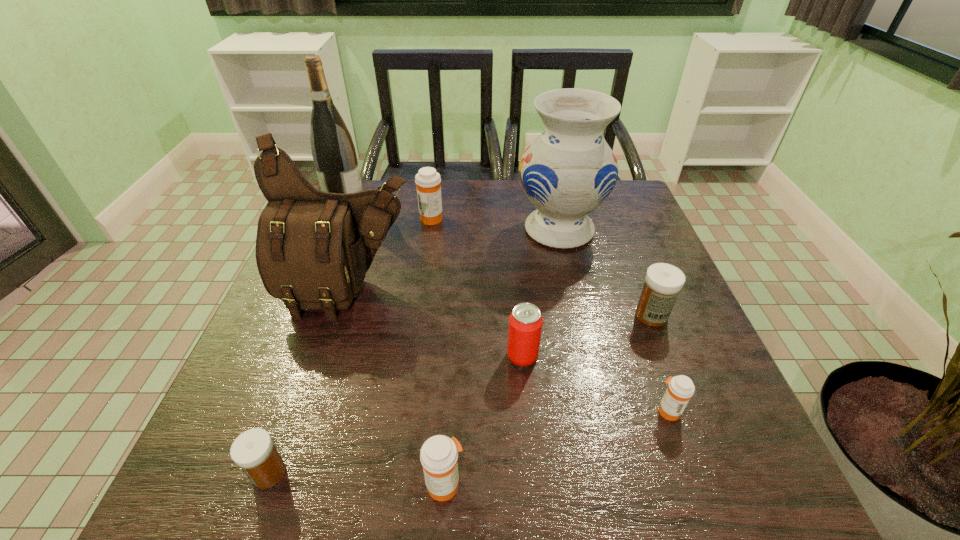
The width and height of the screenshot is (960, 540). What are the coordinates of `vacant space that satisfies the following two spatial constraints: 1. on the front-facing side of the brown shoulder bag; 2. on the right side of the red beer can` in the screenshot? It's located at (329, 356).

Identify the location of free space that satisfies the following two spatial constraints: 1. on the back side of the fourth medicine from right to left; 2. on the label of the brown wine bottle. (434, 202).

You are a GUI agent. You are given a task and a screenshot of the screen. Output one action in this format:
    pyautogui.click(x=<x>, y=<y>)
    Task: Click on the vacant space that satisfies the following two spatial constraints: 1. on the label of the third medicine from left to right; 2. on the right side of the wine bottle
    
    Given the screenshot: What is the action you would take?
    pos(228,484)